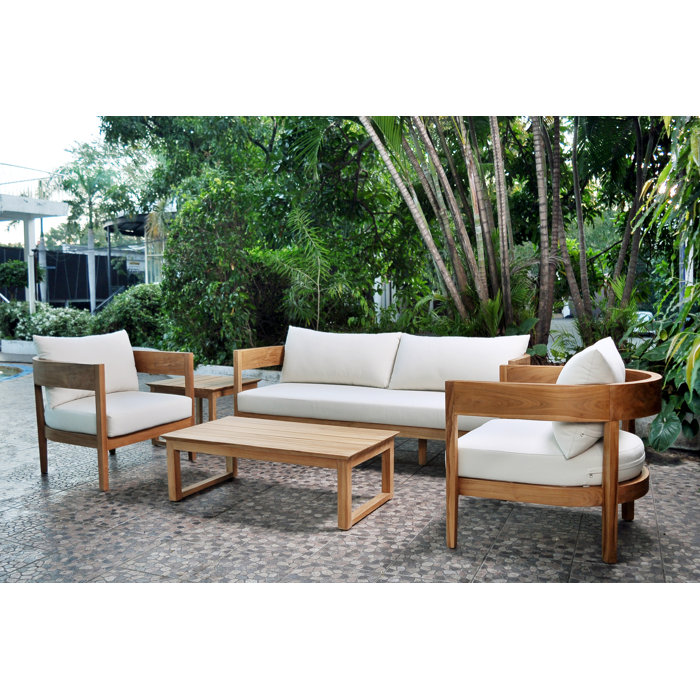
Where is `curved back chairs`? Image resolution: width=700 pixels, height=700 pixels. curved back chairs is located at coordinates (642, 397), (38, 365).